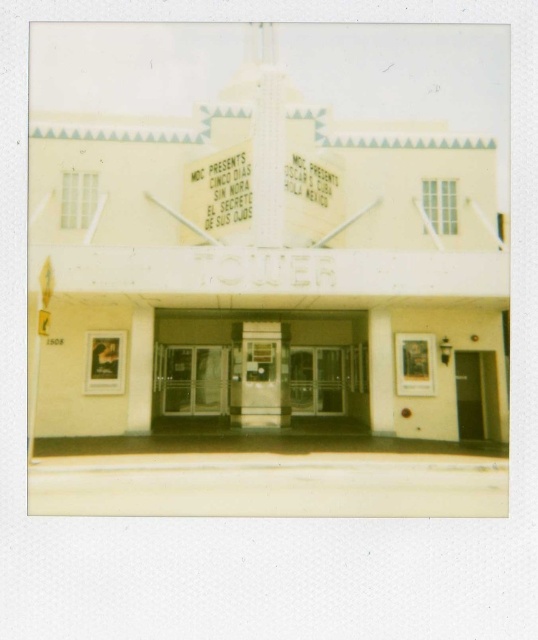
Does clear glass doors at center have a larger size compared to black glass door at center?

Yes, clear glass doors at center is bigger than black glass door at center.

This screenshot has height=640, width=538. I want to click on clear glass doors at center, so click(x=193, y=381).

Which is in front, point (223, 412) or point (484, 400)?

Positioned in front is point (484, 400).

Find the location of a particular element. This screenshot has width=538, height=640. clear glass doors at center is located at coordinates (193, 381).

Does beige concrete theater at center lie behind translucent glass doors at center?

No, beige concrete theater at center is closer to the viewer.

The width and height of the screenshot is (538, 640). What do you see at coordinates (267, 218) in the screenshot? I see `beige concrete theater at center` at bounding box center [267, 218].

Which is behind, point (201, 44) or point (303, 420)?

The point (201, 44) is more distant.

The image size is (538, 640). I want to click on beige concrete theater at center, so click(267, 218).

Can you confirm if translucent glass doors at center is shorter than clear glass doors at center?

Yes, translucent glass doors at center is shorter than clear glass doors at center.

Describe the element at coordinates (259, 371) in the screenshot. I see `translucent glass doors at center` at that location.

Does point (208, 349) come in front of point (174, 376)?

No, it is behind (174, 376).

Find the location of a particular element. translucent glass doors at center is located at coordinates (259, 371).